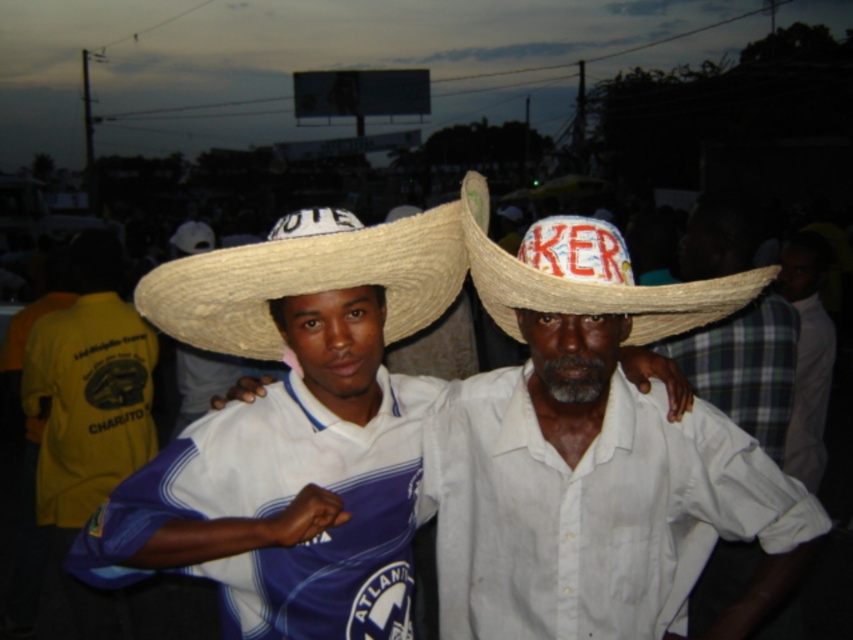
You are a photographer trying to capture a portrait of the two people in the scene. You want to ensure that both the white cotton shirt at center and the straw hat at center are clearly visible in the photo. Based on their sizes, which object should you focus on first to ensure proper exposure?

The white cotton shirt at center is taller than the straw hat at center, so focusing on the white cotton shirt at center first will ensure proper exposure since it occupies more space in the frame.

You are trying to determine which item takes up more space in the image between the white cotton shirt at center and the straw hat at center. Which one is larger?

The white cotton shirt at center occupies less space than the straw hat at center, so the straw hat at center is larger.

Based on the photo, you are a photographer setting up a camera to capture the scene. You need to ensure that the natural straw hat at center and the plaid fabric shirt at right are both clearly visible. Given their sizes, which object should you focus on first to ensure proper framing?

The natural straw hat at center has a larger width than the plaid fabric shirt at right, so focusing on the natural straw hat at center first would ensure proper framing since it occupies more space in the composition.